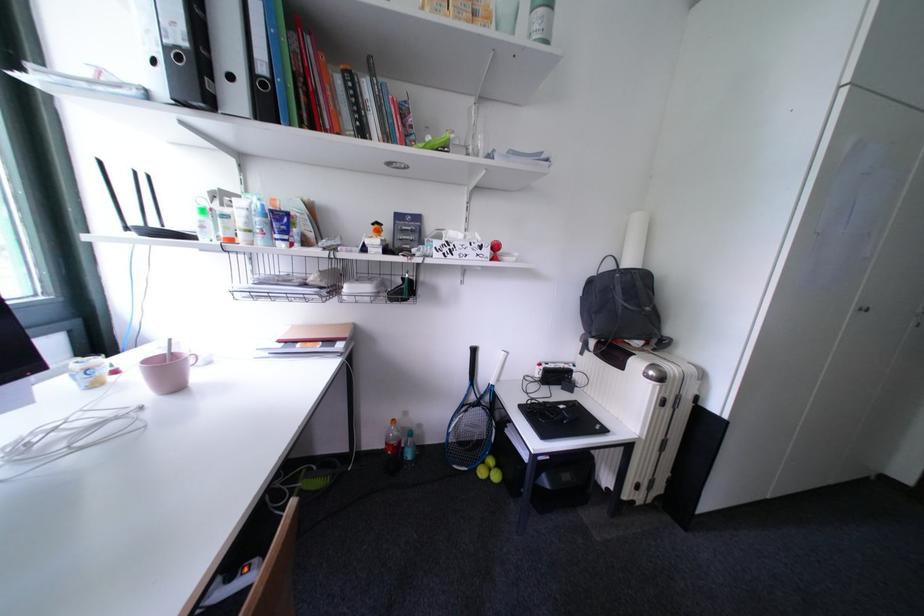
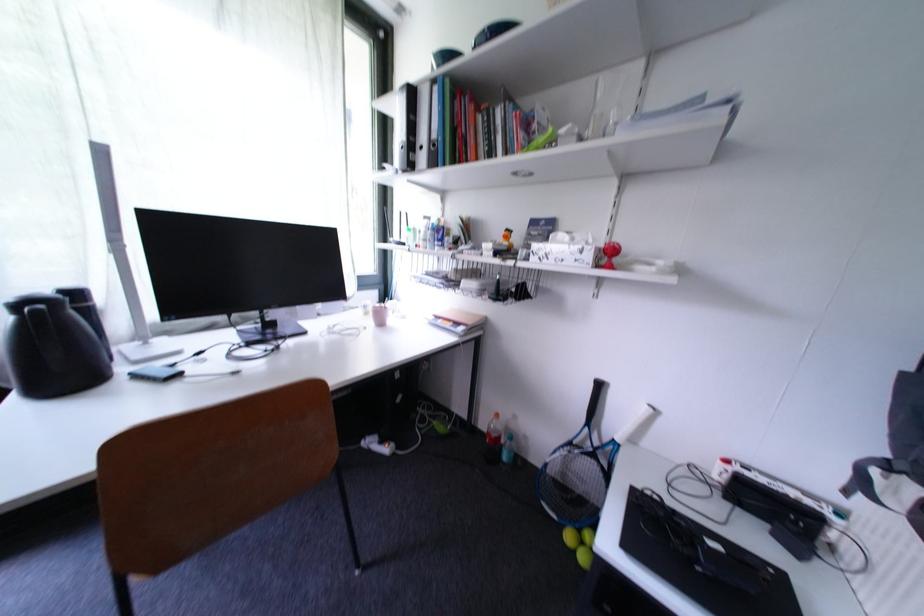
In the second image, find the point that corresponds to point 238,79 in the first image.

(430, 150)